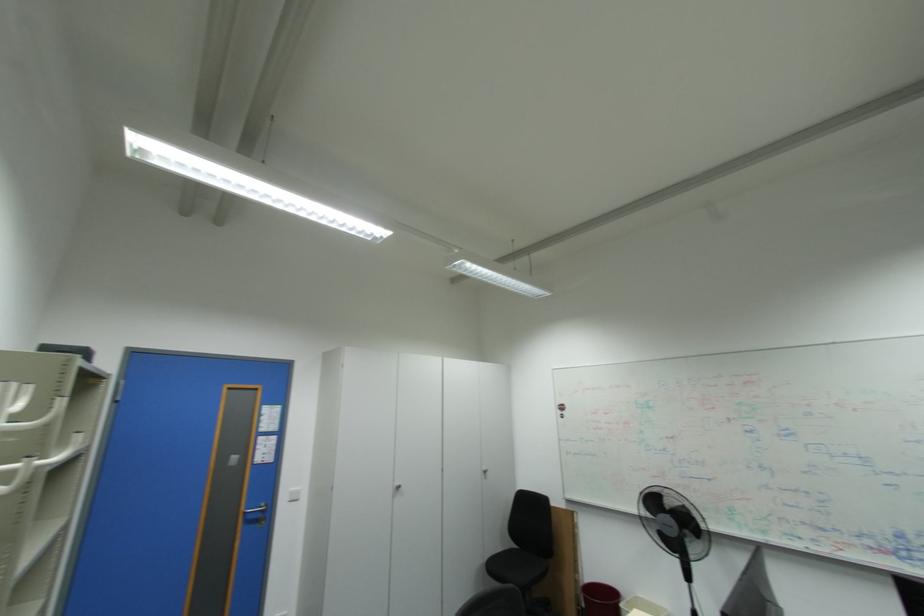
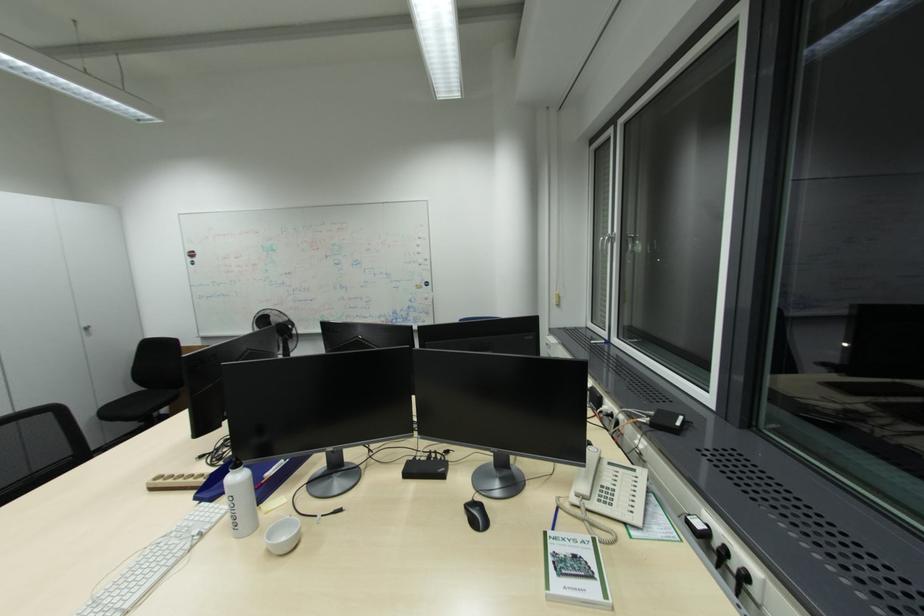
First-person continuous shooting, in which direction is the camera rotating?

The camera's rotation is toward right-down.